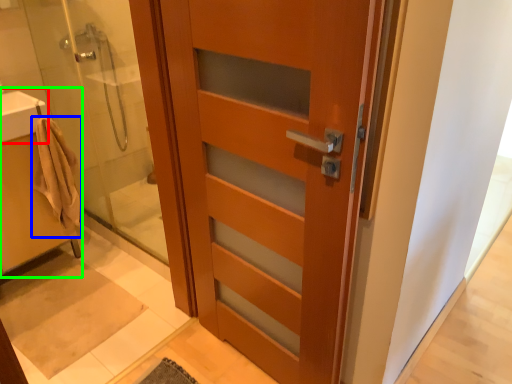
Question: Which is farther away from sink (highlighted by a red box)? bathrobe (highlighted by a blue box) or sink (highlighted by a green box)?

Choices:
 (A) bathrobe
 (B) sink

Answer: (B)